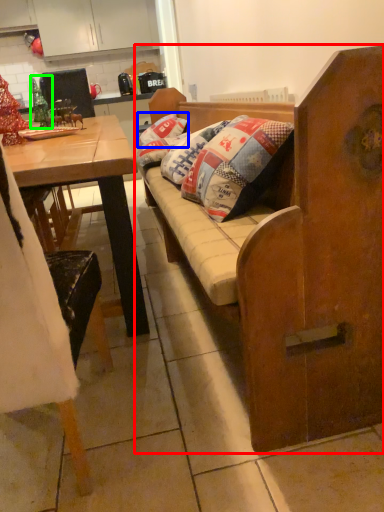
Question: Considering the real-world distances, which object is closest to studio couch (highlighted by a red box)? pillow (highlighted by a blue box) or christmas decoration (highlighted by a green box).

Choices:
 (A) pillow
 (B) christmas decoration

Answer: (B)